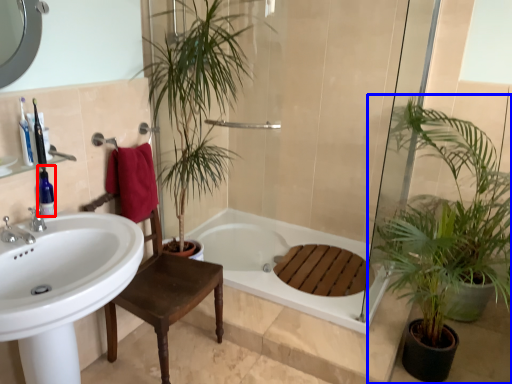
Question: Which object is closer to the camera taking this photo, toiletry (highlighted by a red box) or houseplant (highlighted by a blue box)?

Choices:
 (A) toiletry
 (B) houseplant

Answer: (B)